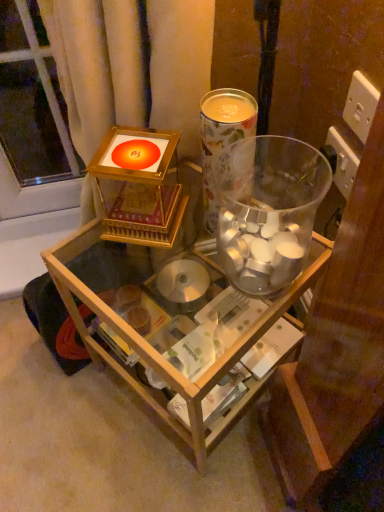
Locate an element on the screen. free spot to the left of transparent glass vase at center, the 2th beverage from the top is located at coordinates (157, 289).